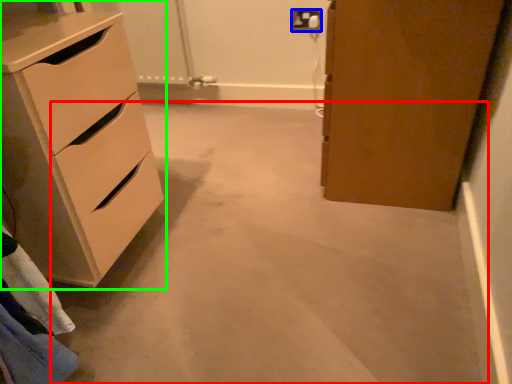
Question: Which is nearer to the concrete (highlighted by a red box)? electric outlet (highlighted by a blue box) or chest of drawers (highlighted by a green box).

Choices:
 (A) electric outlet
 (B) chest of drawers

Answer: (B)